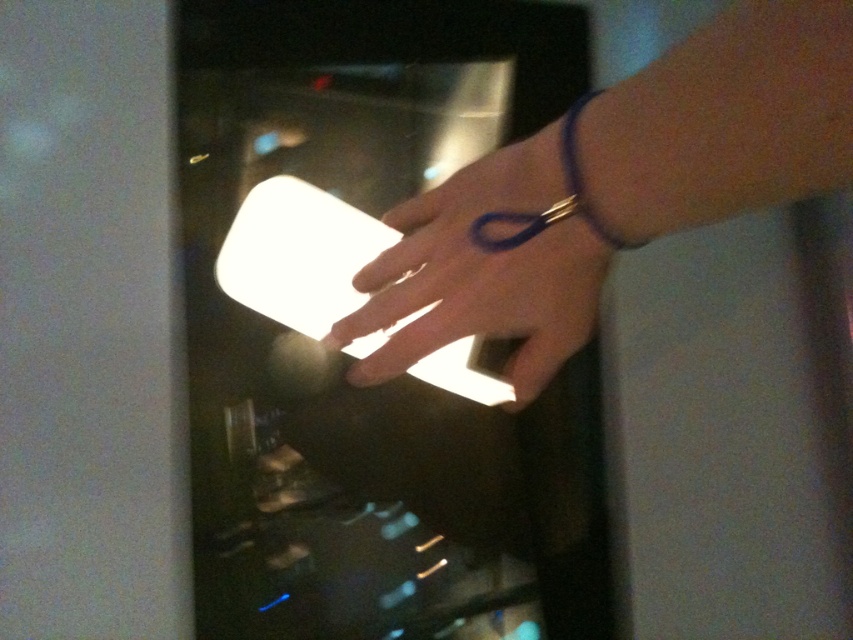
Question: Which point is closer to the camera?

Choices:
 (A) white matte ring at center
 (B) purple rubber band at upper right

Answer: (B)

Question: Does smooth skin hand at center appear on the left side of purple rubber band at upper right?

Choices:
 (A) yes
 (B) no

Answer: (A)

Question: Is white matte ring at center bigger than purple rubber band at upper right?

Choices:
 (A) no
 (B) yes

Answer: (B)

Question: Is smooth skin hand at center to the left of purple rubber band at upper right from the viewer's perspective?

Choices:
 (A) yes
 (B) no

Answer: (A)

Question: Among these objects, which one is nearest to the camera?

Choices:
 (A) smooth skin hand at center
 (B) white matte ring at center

Answer: (A)

Question: Which point appears farthest from the camera in this image?

Choices:
 (A) (582, 106)
 (B) (488, 246)
 (C) (503, 294)

Answer: (C)